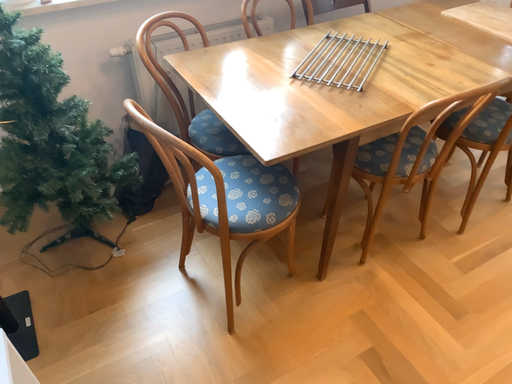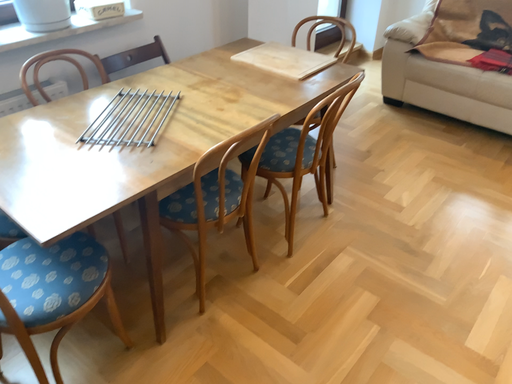
Question: Which way did the camera rotate in the video?

Choices:
 (A) rotated upward
 (B) rotated downward

Answer: (A)